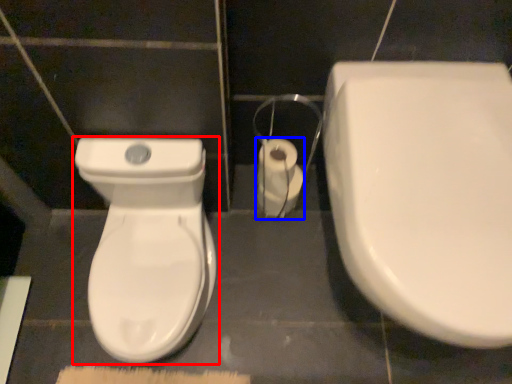
Question: Among these objects, which one is nearest to the camera, toilet (highlighted by a red box) or toilet paper (highlighted by a blue box)?

Choices:
 (A) toilet
 (B) toilet paper

Answer: (A)